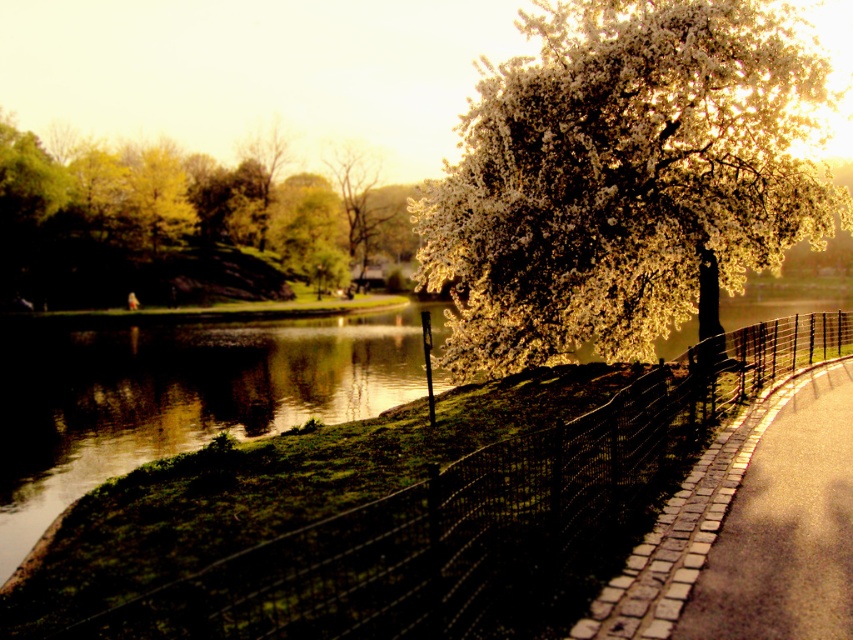
Question: Where is green leafy tree at left located in relation to brick paved path at center right in the image?

Choices:
 (A) right
 (B) left

Answer: (B)

Question: Among these objects, which one is nearest to the camera?

Choices:
 (A) brick paved path at center right
 (B) smooth white blossoms at upper center
 (C) green leafy tree at left
 (D) white blossoming tree at upper right

Answer: (A)

Question: Among these objects, which one is nearest to the camera?

Choices:
 (A) white blossoming tree at upper right
 (B) brick paved path at center right

Answer: (B)

Question: Considering the relative positions of green leafy tree at left and smooth white blossoms at upper center in the image provided, where is green leafy tree at left located with respect to smooth white blossoms at upper center?

Choices:
 (A) right
 (B) left

Answer: (B)

Question: Does green leafy tree at left have a smaller size compared to brick paved path at center right?

Choices:
 (A) no
 (B) yes

Answer: (A)

Question: Among these points, which one is nearest to the camera?

Choices:
 (A) (368, 284)
 (B) (41, 276)
 (C) (699, 493)

Answer: (C)